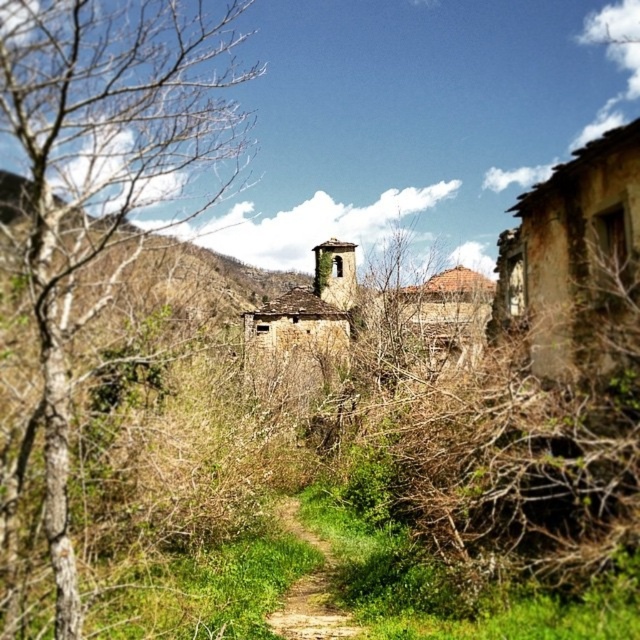
You are standing at point (x=102, y=173) in the scene. What is the nearest object to you?

The nearest object to you is the bare wood tree at left located at point (x=102, y=173).

You are a hiker who wants to walk along the brown dirt path at center. However, there is a bare wood tree at left in the way. Can you walk through the path without going around the tree?

The bare wood tree at left is positioned over brown dirt path at center, so the tree is blocking the path. You will need to go around the tree to walk along the brown dirt path at center.

You are a hiker who wants to walk along the brown dirt path at center while avoiding the bare wood tree at left. Is the path wide enough to walk around the tree?

The bare wood tree at left is wider than the brown dirt path at center, so the path is not wide enough to walk around the tree safely.